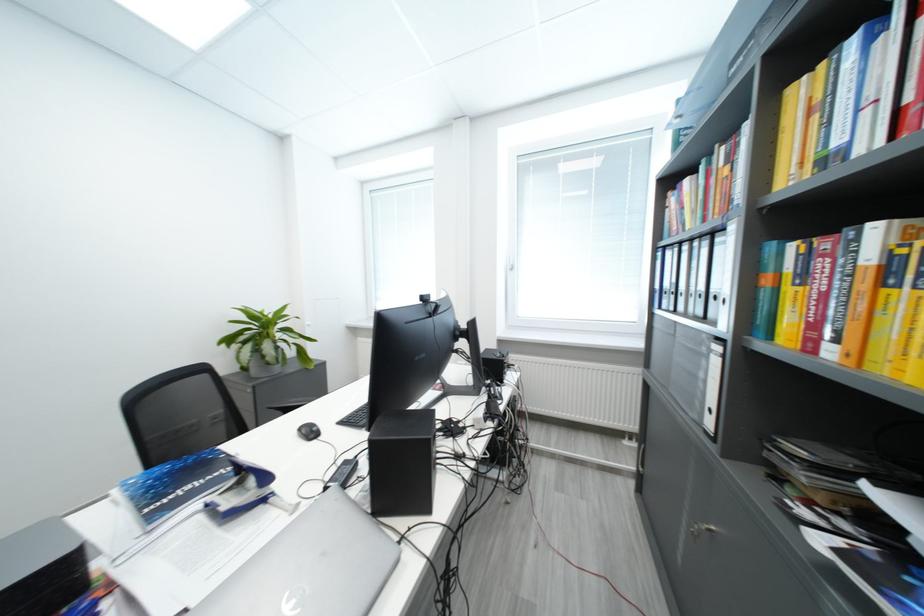
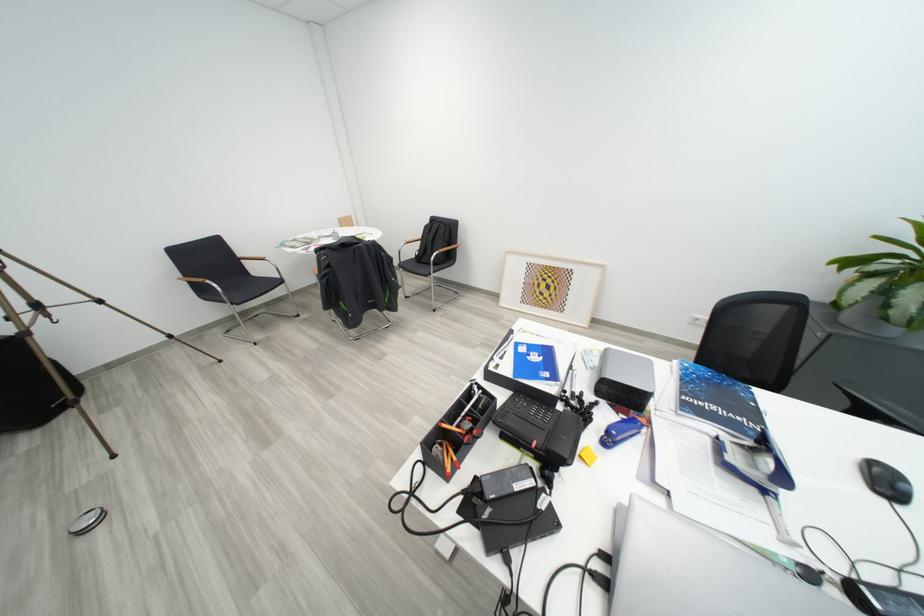
The first image is from the beginning of the video and the second image is from the end. How did the camera likely rotate when shooting the video?

The camera's rotation is toward left-down.